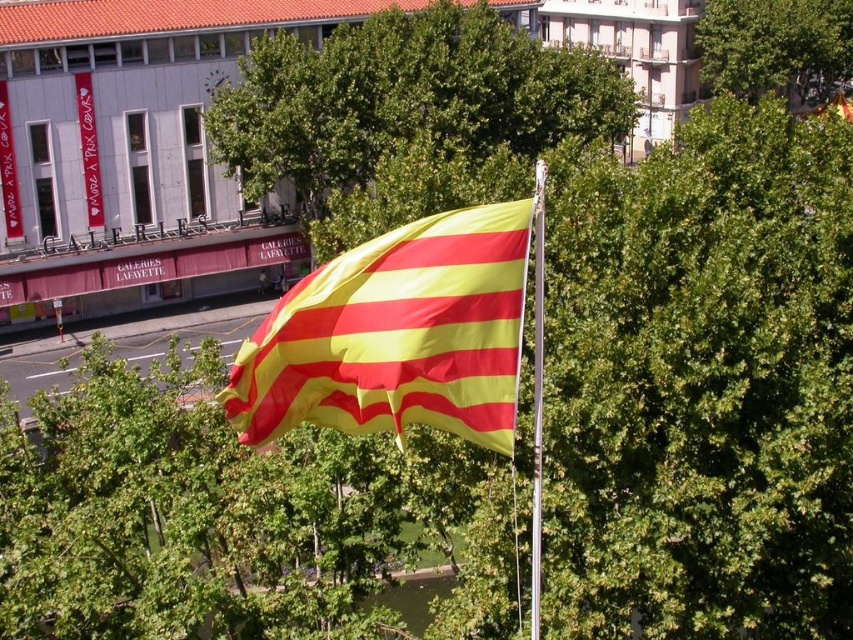
Question: Which point appears closest to the camera in this image?

Choices:
 (A) (265, 52)
 (B) (531, 616)
 (C) (352, 420)

Answer: (C)

Question: Is green leafy tree at center above yellow/red striped fabric at center?

Choices:
 (A) yes
 (B) no

Answer: (A)

Question: Can you confirm if green leafy tree at center is bigger than silver metallic flag pole at center?

Choices:
 (A) no
 (B) yes

Answer: (B)

Question: Which point appears closest to the camera in this image?

Choices:
 (A) (802, 8)
 (B) (473, 426)
 (C) (583, 118)

Answer: (B)

Question: Which point is farther to the camera?

Choices:
 (A) (816, 93)
 (B) (573, 67)
 (C) (535, 170)

Answer: (A)

Question: Is green leafy tree at center thinner than silver metallic flag pole at center?

Choices:
 (A) yes
 (B) no

Answer: (B)